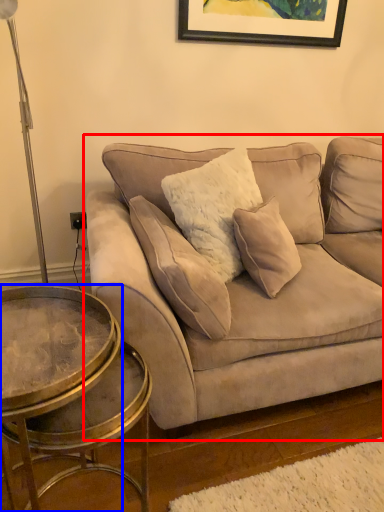
Question: Which object is closer to the camera taking this photo, studio couch (highlighted by a red box) or coffee table (highlighted by a blue box)?

Choices:
 (A) studio couch
 (B) coffee table

Answer: (B)